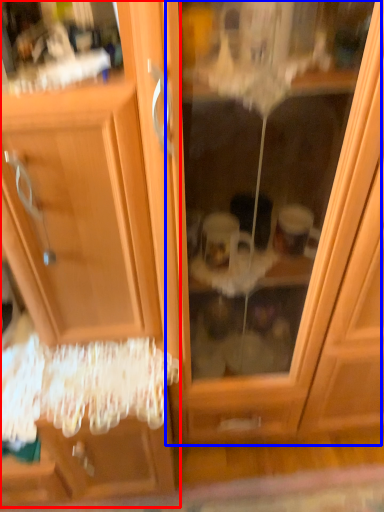
Question: Which point is closer to the camera, dresser (highlighted by a red box) or screen door (highlighted by a blue box)?

Choices:
 (A) dresser
 (B) screen door

Answer: (A)